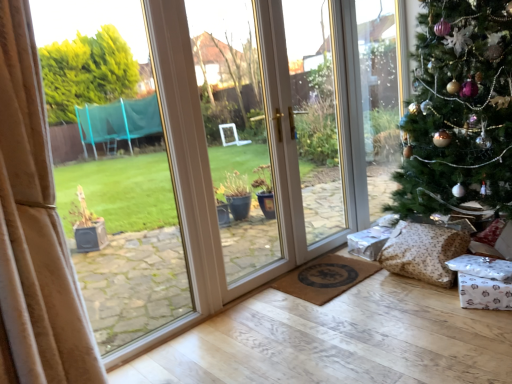
Find the location of a particular element. This screenshot has width=512, height=384. green textured christmas tree at right is located at coordinates (459, 112).

This screenshot has width=512, height=384. Describe the element at coordinates (459, 112) in the screenshot. I see `green textured christmas tree at right` at that location.

This screenshot has height=384, width=512. Find the location of `brown textured doormat at lower center`. brown textured doormat at lower center is located at coordinates coord(325,278).

Where is `brown textured pillow at lower right`? This screenshot has width=512, height=384. brown textured pillow at lower right is located at coordinates (423, 252).

Considering the positions of objects green textured christmas tree at right and brown textured pillow at lower right in the image provided, who is more to the left, green textured christmas tree at right or brown textured pillow at lower right?

From the viewer's perspective, brown textured pillow at lower right appears more on the left side.

From the image's perspective, between green textured christmas tree at right and brown textured pillow at lower right, who is located below?

brown textured pillow at lower right is shown below in the image.

Consider the image. Is green textured christmas tree at right further to the viewer compared to brown textured pillow at lower right?

No, it is not.

Is the surface of green textured christmas tree at right in direct contact with brown textured pillow at lower right?

There is a gap between green textured christmas tree at right and brown textured pillow at lower right.

Is brown textured pillow at lower right wider than green textured christmas tree at right?

Incorrect, the width of brown textured pillow at lower right does not surpass that of green textured christmas tree at right.

From a real-world perspective, is brown textured pillow at lower right physically located above or below green textured christmas tree at right?

Clearly, from a real-world perspective, brown textured pillow at lower right is below green textured christmas tree at right.

Does brown textured pillow at lower right turn towards green textured christmas tree at right?

No, brown textured pillow at lower right is not oriented towards green textured christmas tree at right.

Can you see green textured christmas tree at right touching brown textured doormat at lower center?

green textured christmas tree at right and brown textured doormat at lower center are not in contact.

Is green textured christmas tree at right not within brown textured doormat at lower center?

Yes, green textured christmas tree at right is outside of brown textured doormat at lower center.

How many degrees apart are the facing directions of green textured christmas tree at right and brown textured doormat at lower center?

The facing directions of green textured christmas tree at right and brown textured doormat at lower center are 0.411 degrees apart.

The width and height of the screenshot is (512, 384). I want to click on doormat that appears behind the green textured christmas tree at right, so click(x=325, y=278).

From the image's perspective, is brown textured doormat at lower center located above green textured christmas tree at right?

Actually, brown textured doormat at lower center appears below green textured christmas tree at right in the image.

Does point (310, 267) come behind point (410, 177)?

Yes, it is behind point (410, 177).

Is brown textured doormat at lower center shorter than green textured christmas tree at right?

Correct, brown textured doormat at lower center is not as tall as green textured christmas tree at right.

Find the location of a particular element. Image resolution: width=512 pixels, height=384 pixels. christmas tree to the right of brown textured doormat at lower center is located at coordinates (459, 112).

Does brown textured doormat at lower center lie in front of brown textured pillow at lower right?

No.

Considering the relative sizes of brown textured doormat at lower center and brown textured pillow at lower right in the image provided, is brown textured doormat at lower center smaller than brown textured pillow at lower right?

Indeed, brown textured doormat at lower center has a smaller size compared to brown textured pillow at lower right.

Does brown textured doormat at lower center appear on the right side of brown textured pillow at lower right?

In fact, brown textured doormat at lower center is to the left of brown textured pillow at lower right.

Is brown textured pillow at lower right oriented towards brown textured doormat at lower center?

No.

From the image's perspective, is brown textured pillow at lower right located above or below brown textured doormat at lower center?

brown textured pillow at lower right is situated higher than brown textured doormat at lower center in the image.

Considering the relative sizes of brown textured pillow at lower right and brown textured doormat at lower center in the image provided, is brown textured pillow at lower right wider than brown textured doormat at lower center?

No.

Does brown textured pillow at lower right appear on the left side of brown textured doormat at lower center?

No.

This screenshot has width=512, height=384. What are the coordinates of `pillow that is on the left side of green textured christmas tree at right` in the screenshot? It's located at (423, 252).

At what (x,y) coordinates should I click in order to perform the action: click on christmas tree lying in front of the brown textured pillow at lower right. Please return your answer as a coordinate pair (x, y). This screenshot has width=512, height=384. Looking at the image, I should click on (459, 112).

Looking at the image, which one is located further to brown textured doormat at lower center, green textured christmas tree at right or brown textured pillow at lower right?

green textured christmas tree at right lies further to brown textured doormat at lower center than the other object.

From the image, which object appears to be nearer to brown textured pillow at lower right, green textured christmas tree at right or brown textured doormat at lower center?

brown textured doormat at lower center is positioned closer to the anchor brown textured pillow at lower right.

Estimate the real-world distances between objects in this image. Which object is further from green textured christmas tree at right, brown textured doormat at lower center or brown textured pillow at lower right?

Among the two, brown textured doormat at lower center is located further to green textured christmas tree at right.

From the image, which object appears to be nearer to brown textured pillow at lower right, brown textured doormat at lower center or green textured christmas tree at right?

brown textured doormat at lower center is positioned closer to the anchor brown textured pillow at lower right.

Estimate the real-world distances between objects in this image. Which object is further from green textured christmas tree at right, brown textured pillow at lower right or brown textured doormat at lower center?

brown textured doormat at lower center.

Looking at the image, which one is located further to brown textured doormat at lower center, brown textured pillow at lower right or green textured christmas tree at right?

The object further to brown textured doormat at lower center is green textured christmas tree at right.

This screenshot has width=512, height=384. Identify the location of pillow between green textured christmas tree at right and brown textured doormat at lower center vertically. coord(423,252).